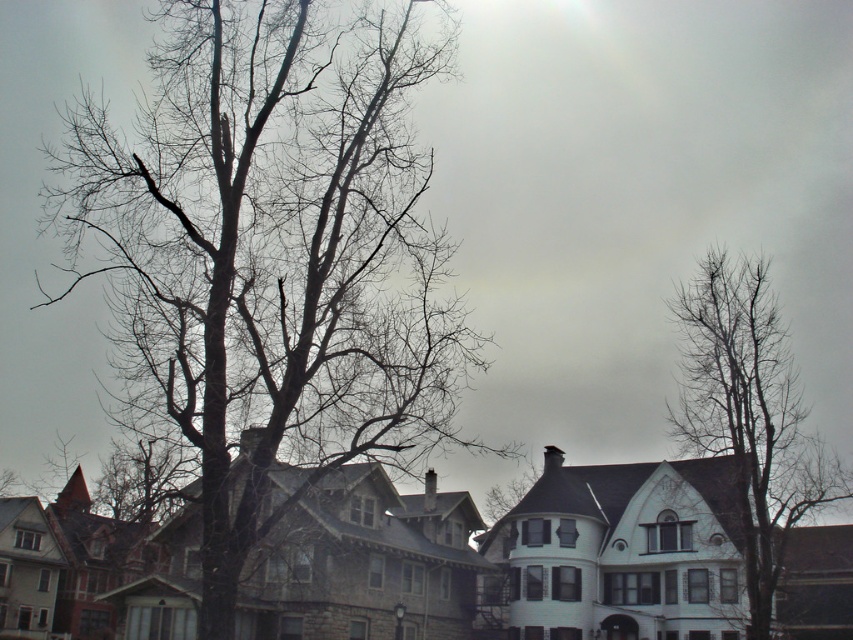
Based on the photo, does bare branches at left have a smaller size compared to bare branches at upper right?

Actually, bare branches at left might be larger than bare branches at upper right.

Who is shorter, bare branches at left or bare branches at upper right?

bare branches at upper right is shorter.

Is point (229, 573) more distant than point (698, 307)?

That is False.

Locate an element on the screen. This screenshot has height=640, width=853. bare branches at left is located at coordinates (271, 256).